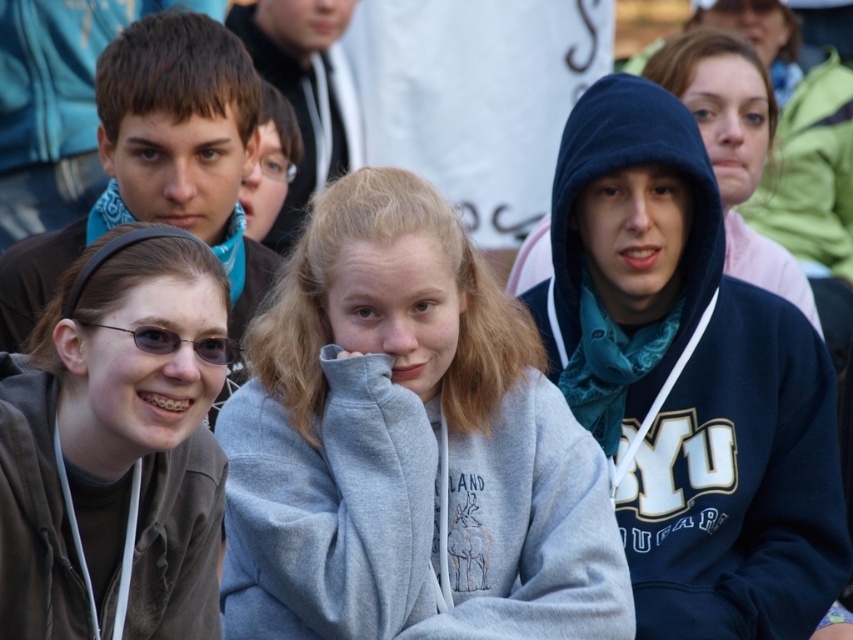
Question: Does navy blue hoodie at center appear over matte brown jacket at lower left?

Choices:
 (A) no
 (B) yes

Answer: (B)

Question: Which object appears farthest from the camera in this image?

Choices:
 (A) navy blue hoodie at center
 (B) matte brown jacket at lower left
 (C) brown hair at center
 (D) gray fleece sweatshirt at center

Answer: (A)

Question: Which object is the farthest from the matte brown jacket at lower left?

Choices:
 (A) brown hair at center
 (B) navy blue hoodie at center
 (C) gray fleece sweatshirt at center

Answer: (A)

Question: Does gray fleece sweatshirt at center appear over brown hair at center?

Choices:
 (A) yes
 (B) no

Answer: (B)

Question: Which point appears closest to the camera in this image?

Choices:
 (A) (712, 328)
 (B) (300, 410)

Answer: (B)

Question: Is navy blue hoodie at center above black plastic glasses at lower left?

Choices:
 (A) yes
 (B) no

Answer: (B)